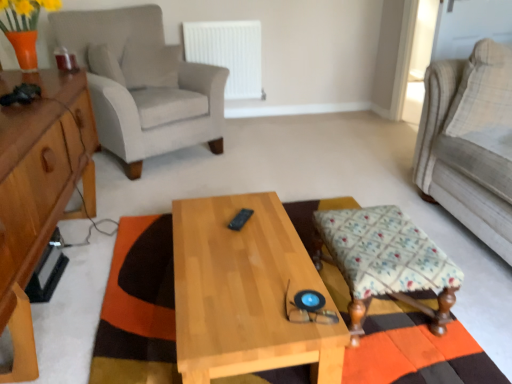
Find the location of `empty space that is ontop of floral fabric stool at lower right (from a real-world perspective)`. empty space that is ontop of floral fabric stool at lower right (from a real-world perspective) is located at coordinates (377, 231).